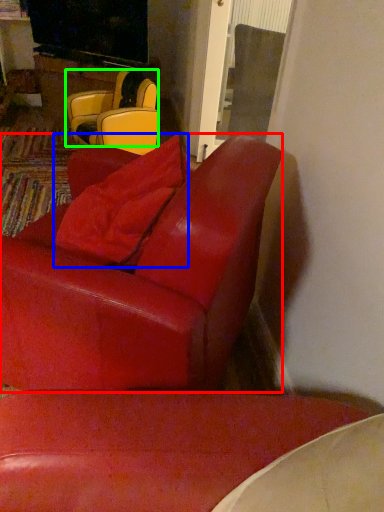
Question: Which object is positioned farthest from chair (highlighted by a red box)? Select from pillow (highlighted by a blue box) and chair (highlighted by a green box).

Choices:
 (A) pillow
 (B) chair

Answer: (B)